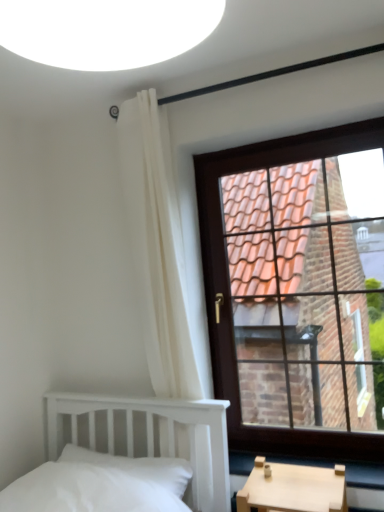
This screenshot has width=384, height=512. Identify the location of free spot above brown wooden window at upper right (from a real-world perspective). tap(313, 135).